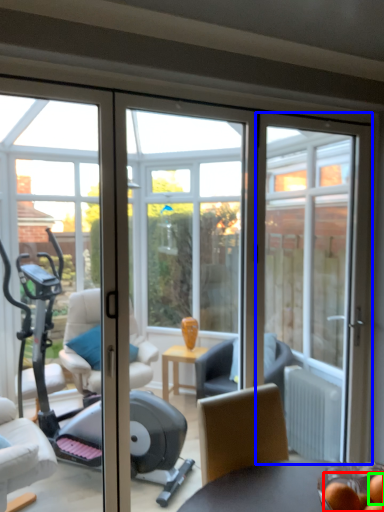
Question: Which object is positioned closest to food (highlighted by a red box)? Select from door (highlighted by a blue box) and food (highlighted by a green box).

Choices:
 (A) door
 (B) food

Answer: (B)